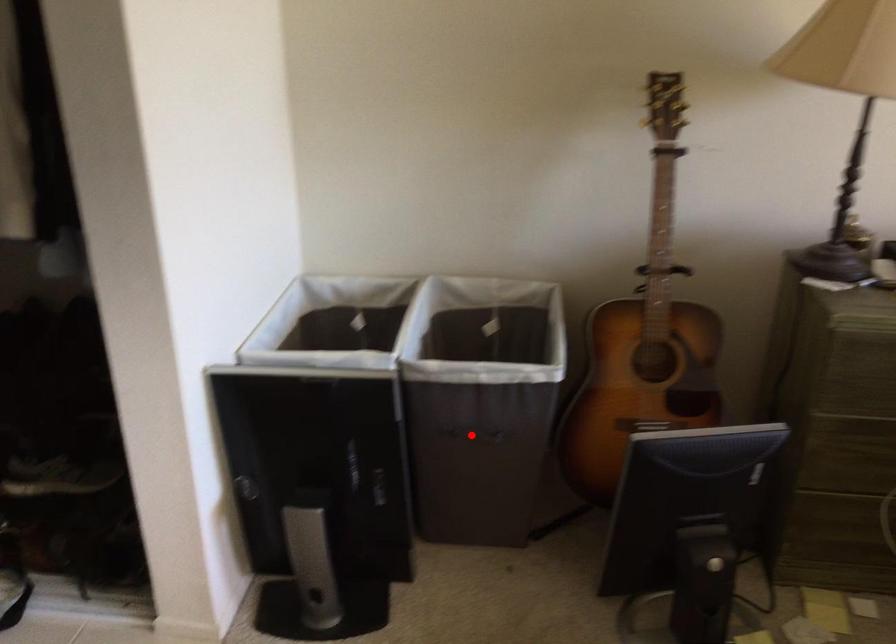
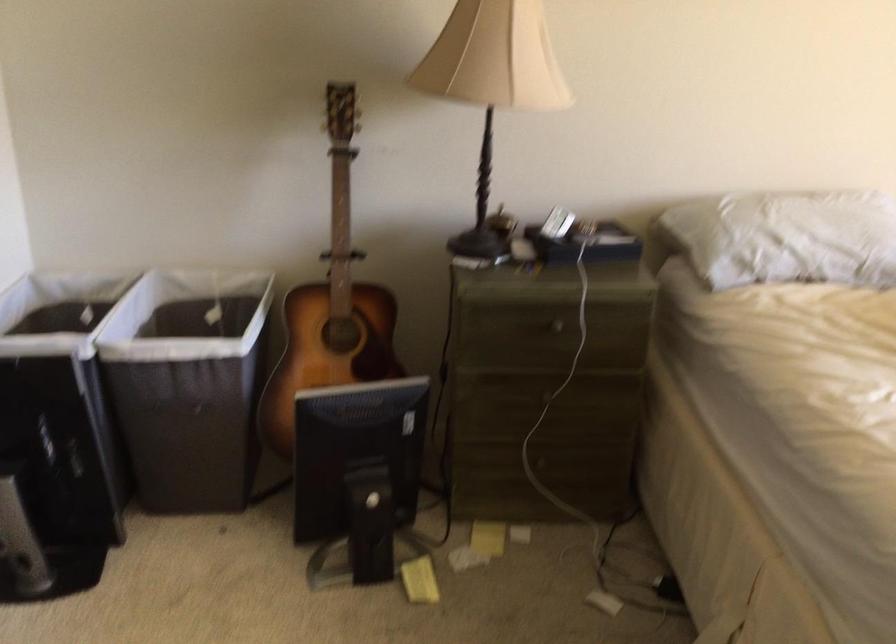
Question: I am providing you with two images of the same scene from different viewpoints. Image1 has a red point marked. In image2, the corresponding 3D location appears at what relative position? Reply with the corresponding letter.

Choices:
 (A) Closer
 (B) Farther

Answer: (B)